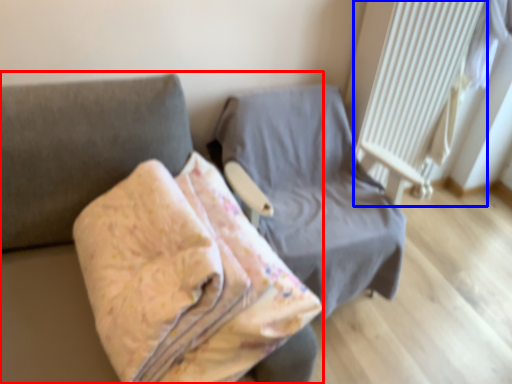
Question: Among these objects, which one is nearest to the camera, furniture (highlighted by a red box) or radiator (highlighted by a blue box)?

Choices:
 (A) furniture
 (B) radiator

Answer: (A)